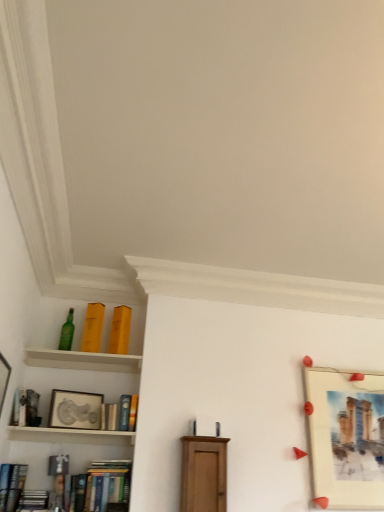
This screenshot has width=384, height=512. Describe the element at coordinates (25, 408) in the screenshot. I see `hardcover book at left, which is the 3th book in top-to-bottom order` at that location.

Find the location of `hardcover book at lower left, arranged as the 4th book when ordered from the bottom`. hardcover book at lower left, arranged as the 4th book when ordered from the bottom is located at coordinates (11, 484).

The height and width of the screenshot is (512, 384). I want to click on yellow matte book at upper left, positioned as the second book in top-to-bottom order, so click(x=120, y=330).

What is the approximate height of matte yellow book at upper left, marked as the eighth book in a bottom-to-top arrangement?

The height of matte yellow book at upper left, marked as the eighth book in a bottom-to-top arrangement, is 12.43 inches.

The image size is (384, 512). In order to click on hardcover book at left, which is the 3th book in top-to-bottom order in this screenshot , I will do `click(25, 408)`.

From the picture: Can we say hardcover books at lower left, marked as the 2th book in a bottom-to-top arrangement, lies outside white wooden shelf at lower left?

Absolutely, hardcover books at lower left, marked as the 2th book in a bottom-to-top arrangement, is external to white wooden shelf at lower left.

Is hardcover books at lower left, marked as the 2th book in a bottom-to-top arrangement, facing towards white wooden shelf at lower left?

No, hardcover books at lower left, marked as the 2th book in a bottom-to-top arrangement, is not facing towards white wooden shelf at lower left.

Are hardcover books at lower left, marked as the 7th book in a top-to-bottom arrangement, and white wooden shelf at lower left making contact?

No.

Locate an element on the screen. Image resolution: width=384 pixels, height=512 pixels. the 3rd book below the white wooden shelf at lower left (from the image's perspective) is located at coordinates (107, 484).

From a real-world perspective, which object rests below the other?

wooden shelf at upper left, from a real-world perspective.

Could you tell me if matte yellow book at upper left, which is the first book from top to bottom, is facing wooden shelf at upper left?

No, matte yellow book at upper left, which is the first book from top to bottom, is not aimed at wooden shelf at upper left.

Does matte yellow book at upper left, which is the first book from top to bottom, appear on the left side of wooden shelf at upper left?

No.

Between matte yellow book at upper left, marked as the eighth book in a bottom-to-top arrangement, and wooden shelf at upper left, which one is positioned behind?

Positioned behind is matte yellow book at upper left, marked as the eighth book in a bottom-to-top arrangement.

Relative to hardcover books at lower left, marked as the 7th book in a top-to-bottom arrangement, is matte silver picture frame at upper left, which is the 1th picture frame in left-to-right order, in front or behind?

Visually, matte silver picture frame at upper left, which is the 1th picture frame in left-to-right order, is located behind hardcover books at lower left, marked as the 7th book in a top-to-bottom arrangement.

Could you tell me if matte silver picture frame at upper left, placed as the second picture frame when sorted from right to left, is facing hardcover books at lower left, marked as the 2th book in a bottom-to-top arrangement?

No, matte silver picture frame at upper left, placed as the second picture frame when sorted from right to left, is not aimed at hardcover books at lower left, marked as the 2th book in a bottom-to-top arrangement.

Which point is more forward, (62, 426) or (125, 469)?

The point (62, 426) is closer to the camera.

Which is more to the right, matte silver picture frame at upper left, which is the 1th picture frame in left-to-right order, or hardcover books at lower left, marked as the 2th book in a bottom-to-top arrangement?

From the viewer's perspective, hardcover books at lower left, marked as the 2th book in a bottom-to-top arrangement, appears more on the right side.

From a real-world perspective, is hardcover books at lower left, marked as the 2th book in a bottom-to-top arrangement, positioned under matte wood cabinet at center based on gravity?

Yes, from a real-world perspective, hardcover books at lower left, marked as the 2th book in a bottom-to-top arrangement, is beneath matte wood cabinet at center.

Who is bigger, hardcover books at lower left, marked as the 7th book in a top-to-bottom arrangement, or matte wood cabinet at center?

With larger size is hardcover books at lower left, marked as the 7th book in a top-to-bottom arrangement.

In order to click on furniture on the right of hardcover books at lower left, marked as the 2th book in a bottom-to-top arrangement in this screenshot , I will do `click(203, 474)`.

From the image's perspective, is hardcover books at lower left, marked as the 7th book in a top-to-bottom arrangement, positioned above or below matte wood cabinet at center?

hardcover books at lower left, marked as the 7th book in a top-to-bottom arrangement, is below matte wood cabinet at center.

The image size is (384, 512). What are the coordinates of `the 2nd book directly beneath the white wooden shelf at lower left (from a real-world perspective)` in the screenshot? It's located at (101, 487).

Considering the relative positions of white wooden shelf at lower left and hardcover books at lower left, the 3th book positioned from the bottom, in the image provided, is white wooden shelf at lower left to the left or to the right of hardcover books at lower left, the 3th book positioned from the bottom,?

white wooden shelf at lower left is positioned on hardcover books at lower left, the 3th book positioned from the bottom,'s right side.

Is hardcover books at lower left, the 3th book positioned from the bottom, surrounded by white wooden shelf at lower left?

Actually, hardcover books at lower left, the 3th book positioned from the bottom, is outside white wooden shelf at lower left.

In the scene shown: Is the depth of white wooden shelf at lower left less than that of hardcover books at lower left, acting as the 6th book starting from the top?

That is False.

Between white wooden shelf at lower left and hardcover book at lower left, arranged as the eighth book when viewed from the top, which one has more height?

Standing taller between the two is hardcover book at lower left, arranged as the eighth book when viewed from the top.

Does white wooden shelf at lower left appear on the right side of hardcover book at lower left, arranged as the eighth book when viewed from the top?

Yes.

Is white wooden shelf at lower left placed right next to hardcover book at lower left, the first book when ordered from bottom to top?

No, white wooden shelf at lower left is not next to hardcover book at lower left, the first book when ordered from bottom to top.

I want to click on cabinet above the hardcover book at lower left, arranged as the eighth book when viewed from the top (from the image's perspective), so click(71, 436).

Which is closer to the camera, (16, 495) or (347, 375)?

Point (16, 495) is closer to the camera than point (347, 375).

Are hardcover book at lower left, arranged as the 4th book when ordered from the bottom, and matte paper picture frame at right, marked as the 1th picture frame in a right-to-left arrangement, making contact?

No, hardcover book at lower left, arranged as the 4th book when ordered from the bottom, is not next to matte paper picture frame at right, marked as the 1th picture frame in a right-to-left arrangement.

From a real-world perspective, which object stands above the other?

matte paper picture frame at right, marked as the 1th picture frame in a right-to-left arrangement, is physically above.

Identify the location of cabinet behind the hardcover books at lower left, marked as the 7th book in a top-to-bottom arrangement. This screenshot has height=512, width=384. (71, 436).

There is a wooden shelf at upper left. At what (x,y) coordinates should I click in order to perform the action: click on the 2nd book above it (from the image's perspective). Please return your answer as a coordinate pair (x, y). Image resolution: width=384 pixels, height=512 pixels. Looking at the image, I should click on (93, 328).

Looking at the image, which one is located closer to matte yellow book at upper left, which is the first book from top to bottom, hardcover book at left, which is the 3th book in top-to-bottom order, or hardcover book at center-left, which is counted as the 4th book, starting from the top?

hardcover book at center-left, which is counted as the 4th book, starting from the top.

Which object lies nearer to the anchor point white wooden shelf at lower left, hardcover book at lower left, the first book when ordered from bottom to top, or hardcover book at left, placed as the sixth book when sorted from bottom to top?

hardcover book at left, placed as the sixth book when sorted from bottom to top, is closer to white wooden shelf at lower left.

From the image, which object appears to be nearer to hardcover book at center-left, which is counted as the 4th book, starting from the top, matte paper picture frame at right, marked as the 1th picture frame in a right-to-left arrangement, or yellow matte book at upper left, positioned as the second book in top-to-bottom order?

Based on the image, yellow matte book at upper left, positioned as the second book in top-to-bottom order, appears to be nearer to hardcover book at center-left, which is counted as the 4th book, starting from the top.

Looking at this image, based on their spatial positions, is white wooden shelf at lower left or hardcover books at lower left, the 3th book positioned from the bottom, closer to hardcover books at lower left, marked as the 7th book in a top-to-bottom arrangement?

hardcover books at lower left, the 3th book positioned from the bottom, is closer to hardcover books at lower left, marked as the 7th book in a top-to-bottom arrangement.

When comparing their distances from hardcover books at lower left, the 3th book positioned from the bottom, does hardcover books at lower left, marked as the 2th book in a bottom-to-top arrangement, or matte silver picture frame at upper left, which is the 1th picture frame in left-to-right order, seem further?

The object further to hardcover books at lower left, the 3th book positioned from the bottom, is matte silver picture frame at upper left, which is the 1th picture frame in left-to-right order.

Looking at the image, which one is located further to hardcover books at lower left, marked as the 2th book in a bottom-to-top arrangement, matte paper picture frame at right, marked as the 2th picture frame in a left-to-right arrangement, or matte silver picture frame at upper left, which is the 1th picture frame in left-to-right order?

Among the two, matte paper picture frame at right, marked as the 2th picture frame in a left-to-right arrangement, is located further to hardcover books at lower left, marked as the 2th book in a bottom-to-top arrangement.

Based on their spatial positions, is hardcover books at lower left, marked as the 2th book in a bottom-to-top arrangement, or hardcover book at left, which is the 3th book in top-to-bottom order, further from green glass bottle at upper left?

Among the two, hardcover books at lower left, marked as the 2th book in a bottom-to-top arrangement, is located further to green glass bottle at upper left.

From the picture: Which object lies further to the anchor point hardcover book at center-left, arranged as the 5th book when ordered from the bottom, hardcover book at lower left, the 5th book when ordered from top to bottom, or wooden shelf at upper left?

Among the two, hardcover book at lower left, the 5th book when ordered from top to bottom, is located further to hardcover book at center-left, arranged as the 5th book when ordered from the bottom.

This screenshot has height=512, width=384. What are the coordinates of `cabinet that lies between yellow matte book at upper left, which ranks as the 7th book in bottom-to-top order, and hardcover books at lower left, the 3th book positioned from the bottom, from top to bottom` in the screenshot? It's located at (71, 436).

The width and height of the screenshot is (384, 512). Find the location of `bottle between matte yellow book at upper left, marked as the eighth book in a bottom-to-top arrangement, and hardcover book at center-left, arranged as the 5th book when ordered from the bottom, vertically`. bottle between matte yellow book at upper left, marked as the eighth book in a bottom-to-top arrangement, and hardcover book at center-left, arranged as the 5th book when ordered from the bottom, vertically is located at coordinates (67, 332).

The height and width of the screenshot is (512, 384). Identify the location of book between matte yellow book at upper left, which is the first book from top to bottom, and wooden shelf at upper left, in the vertical direction. pyautogui.click(x=120, y=330).

You are a GUI agent. You are given a task and a screenshot of the screen. Output one action in this format:
    pyautogui.click(x=<x>, y=<y>)
    Task: Click on the cabinet between green glass bottle at upper left and hardcover books at lower left, marked as the 2th book in a bottom-to-top arrangement, in the up-down direction
    This screenshot has height=512, width=384.
    Given the screenshot: What is the action you would take?
    pyautogui.click(x=71, y=436)